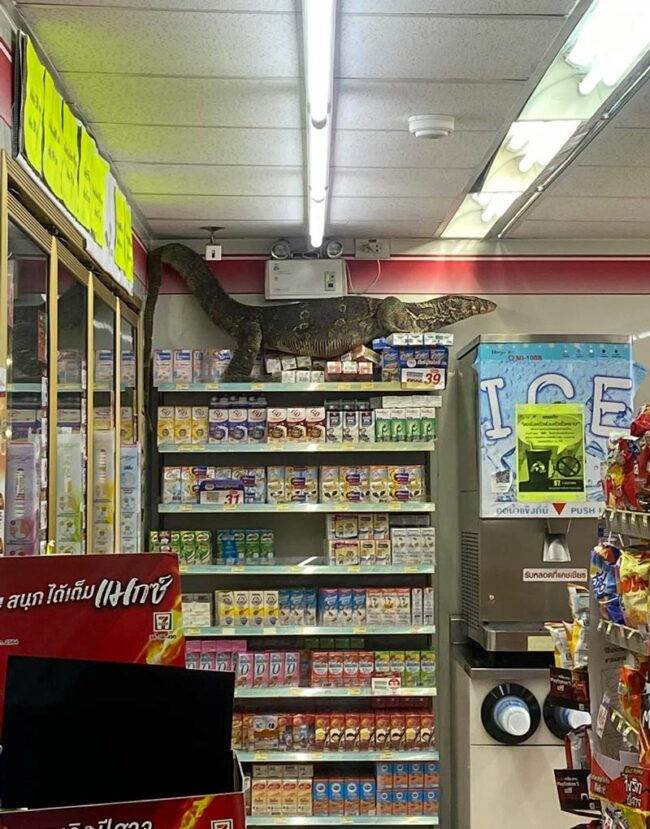
Identify every occurrence of where you would push to dispense ice in the image. Your answer should be formatted as a list of tuples, i.e. [(x1, y1), (x2, y2), ...], where each tuple contains the x and y coordinates of a point satisfying the conditions above.

[(554, 506)]